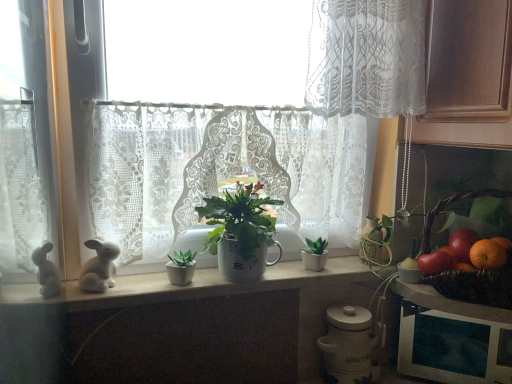
Identify the location of free location to the right of white glossy rabbit at left. The width and height of the screenshot is (512, 384). (157, 289).